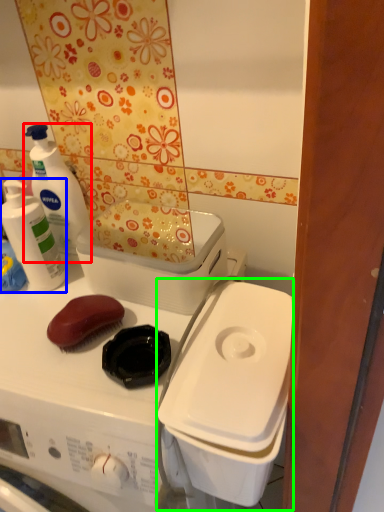
Question: Considering the real-world distances, which object is farthest from cleaning product (highlighted by a red box)? cleaning product (highlighted by a blue box) or appliance (highlighted by a green box)?

Choices:
 (A) cleaning product
 (B) appliance

Answer: (B)